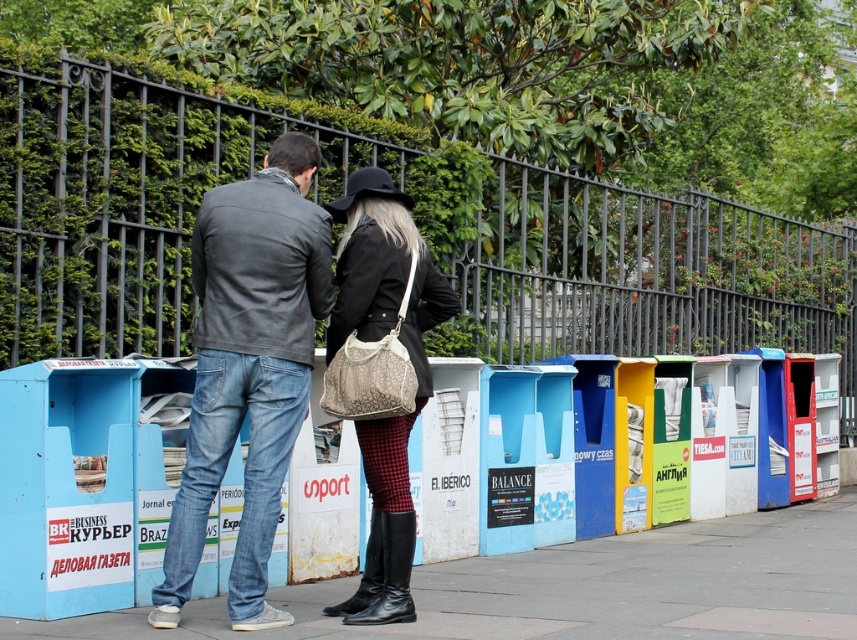
You are a fashion designer observing two people at a newspaper stand. You notice the denim jeans at center and the matte black coat at center. Which clothing item appears larger in size?

The denim jeans at center is bigger than matte black coat at center.

You are a photographer standing at the camera position. You want to take a photo of the black metal fence at upper center. Can you fit the entire fence into your camera frame if your camera has a maximum horizontal field of view of 6 meters?

The black metal fence at upper center and camera are 8.89 meters apart from each other. Since the camera has a maximum horizontal field of view of 6 meters, the distance between them is greater than the field of view, so the entire fence cannot be captured in one frame.

You are a delivery person trying to navigate between the black metal fence at upper center and the matte black coat at center. Which direction should you move to avoid the fence?

The black metal fence at upper center is on the right side of the matte black coat at center, so to avoid the fence, move to the left side of the matte black coat at center.